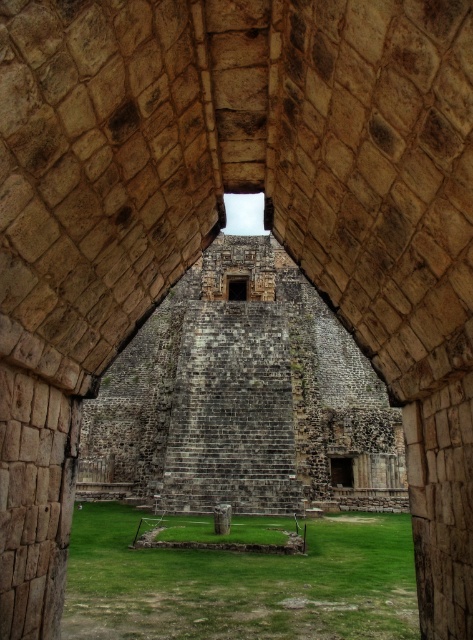
Is green grass at center further to camera compared to transparent glass window at center?

That is False.

Who is higher up, green grass at center or transparent glass window at center?

transparent glass window at center is higher up.

Does point (230, 582) come behind point (246, 276)?

No, (230, 582) is closer to viewer.

The width and height of the screenshot is (473, 640). I want to click on green grass at center, so click(241, 582).

How far apart are green grass at center and dark stone window at center?

A distance of 47.54 meters exists between green grass at center and dark stone window at center.

Does point (164, 573) come in front of point (332, 477)?

That is True.

Measure the distance between green grass at center and camera.

green grass at center and camera are 133.07 feet apart.

Locate an element on the screen. The height and width of the screenshot is (640, 473). green grass at center is located at coordinates 241,582.

Who is taller, dark stone window at center or transparent glass window at center?

With more height is transparent glass window at center.

Who is more forward, (344, 467) or (238, 292)?

Point (344, 467) is in front.

Identify the location of dark stone window at center. 341,472.